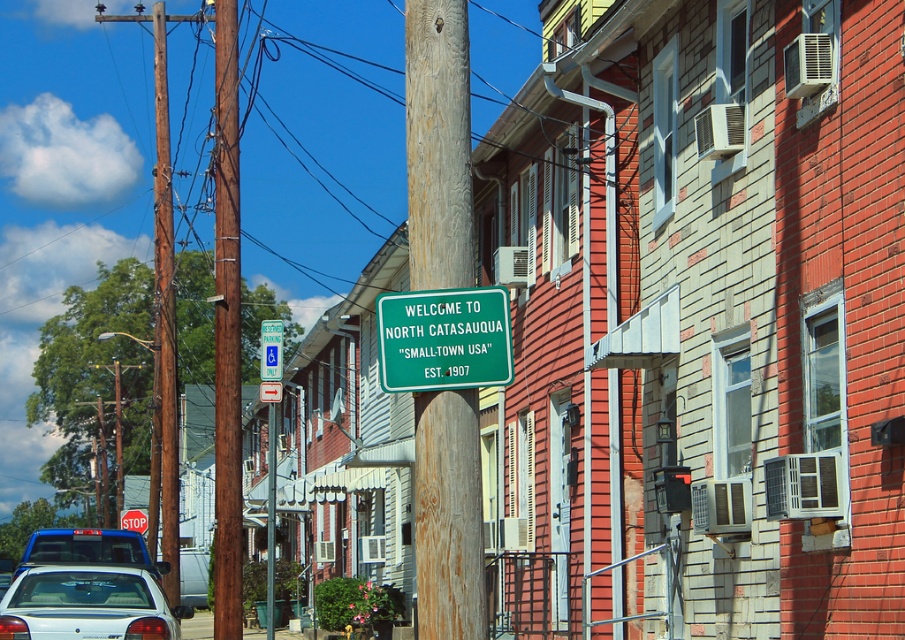
Consider the image. You are standing at the origin point in the street scene of North Catasauqua. You see two points marked as point 1 at coordinates (429, 241) and point 2 at coordinates (225, 211). Which point is closer to you?

Point 1 at coordinates (429, 241) is closer to you because it is in front of point 2 at coordinates (225, 211).

You are a delivery person trying to avoid hitting the green plastic sign at center and the brown wooden telegraph pole at left with your van. Which object is shorter and therefore safer to maneuver around?

The green plastic sign at center is shorter than the brown wooden telegraph pole at left, making it safer to maneuver around the green plastic sign at center.

You are a delivery person trying to secure a package to a pole in North Catasauqua. The package requires a pole that is at least 1.5 meters in diameter. You see the wooden post at center and the brown wooden telegraph pole at center. Which pole should you choose?

The brown wooden telegraph pole at center is larger than the wooden post at center, so you should choose the brown wooden telegraph pole at center since it likely meets the required diameter.